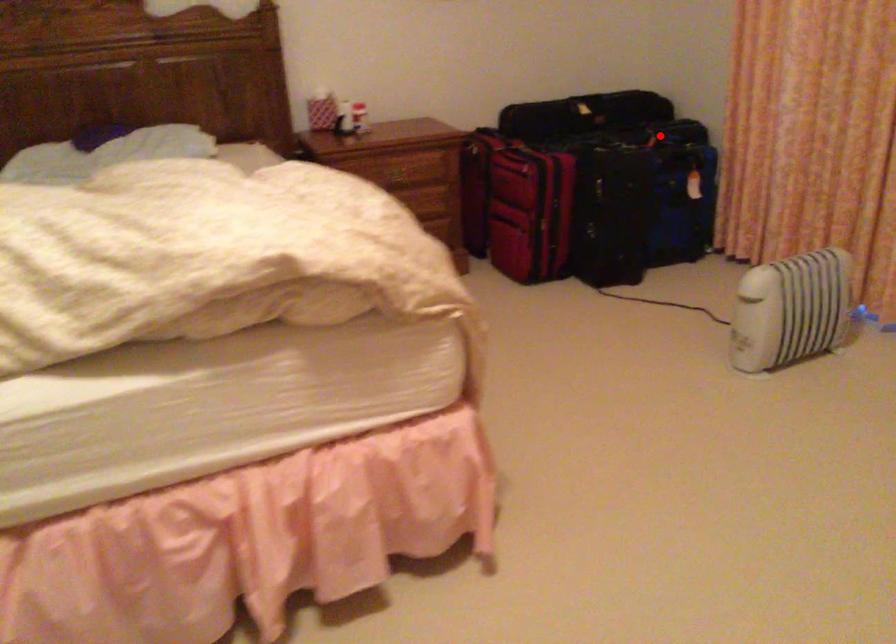
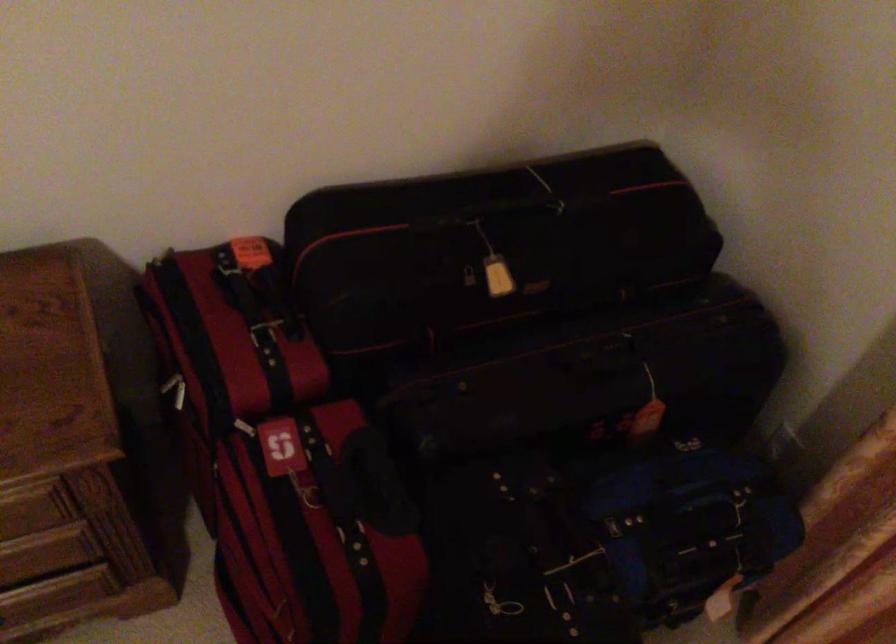
Question: I am providing you with two images of the same scene from different viewpoints. In image1, a red point is highlighted. Considering the same 3D point in image2, which of the following is correct?

Choices:
 (A) It is closer
 (B) It is farther

Answer: (A)